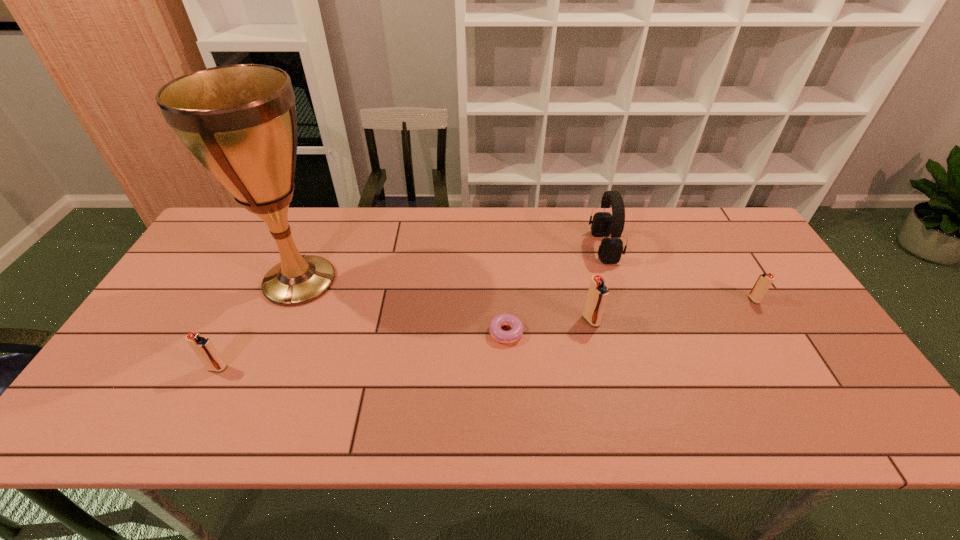
Choose which igniter is the second nearest neighbor to the nearest igniter. Please provide its 2D coordinates. Your answer should be formatted as a tuple, i.e. [(x, y)], where the tuple contains the x and y coordinates of a point satisfying the conditions above.

[(764, 281)]

Identify the location of igniter that is the second closest to the third object from right to left. This screenshot has height=540, width=960. click(202, 346).

Locate an element on the screen. vacant space that satisfies the following two spatial constraints: 1. on the headband of the fifth shortest object; 2. on the front side of the doughnut is located at coordinates (630, 329).

Locate an element on the screen. free point that satisfies the following two spatial constraints: 1. on the headband of the fifth object from left to right; 2. on the front side of the trophy cup is located at coordinates (614, 281).

This screenshot has width=960, height=540. In order to click on free spot that satisfies the following two spatial constraints: 1. on the front side of the rightmost igniter; 2. on the left side of the trophy cup in this screenshot , I will do `click(292, 300)`.

You are a GUI agent. You are given a task and a screenshot of the screen. Output one action in this format:
    pyautogui.click(x=<x>, y=<y>)
    Task: Click on the vacant space that satisfies the following two spatial constraints: 1. on the headband of the rightmost object; 2. on the right side of the second object from right to left
    The height and width of the screenshot is (540, 960).
    Given the screenshot: What is the action you would take?
    pyautogui.click(x=620, y=300)